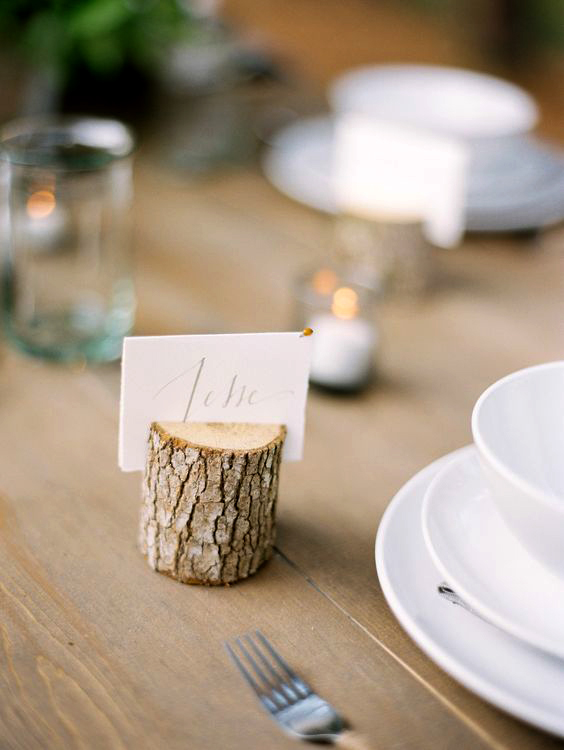
Where is `plate`? Image resolution: width=564 pixels, height=750 pixels. plate is located at coordinates (446, 643).